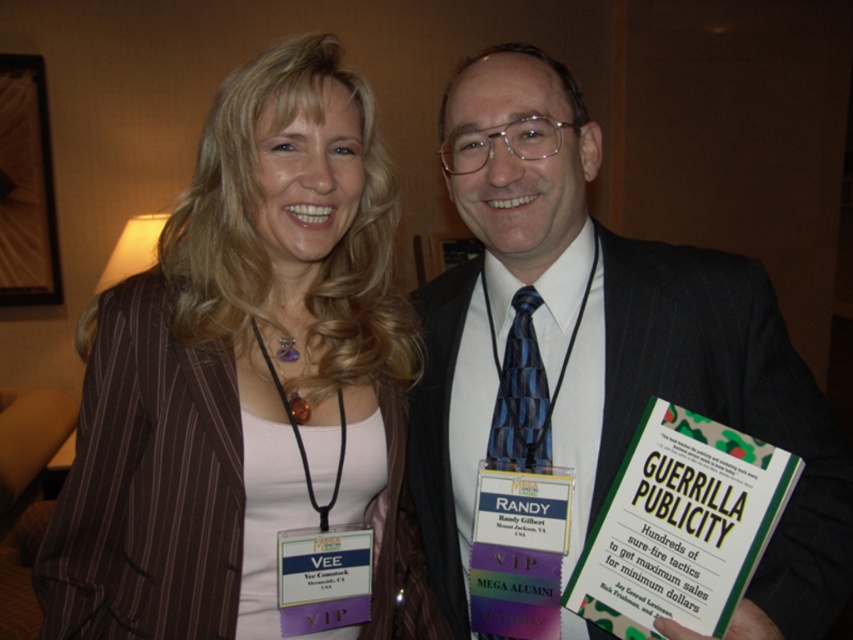
Question: Is brown pinstriped blazer at upper left bigger than dark suit at center?

Choices:
 (A) yes
 (B) no

Answer: (B)

Question: Does brown pinstriped blazer at upper left appear on the left side of dark suit at center?

Choices:
 (A) yes
 (B) no

Answer: (A)

Question: Which point appears closest to the camera in this image?

Choices:
 (A) (421, 605)
 (B) (592, 499)

Answer: (B)

Question: Which point appears closest to the camera in this image?

Choices:
 (A) (277, 294)
 (B) (828, 564)

Answer: (B)

Question: Does brown pinstriped blazer at upper left have a smaller size compared to dark suit at center?

Choices:
 (A) yes
 (B) no

Answer: (A)